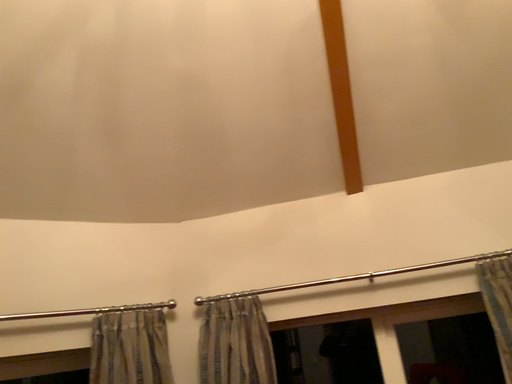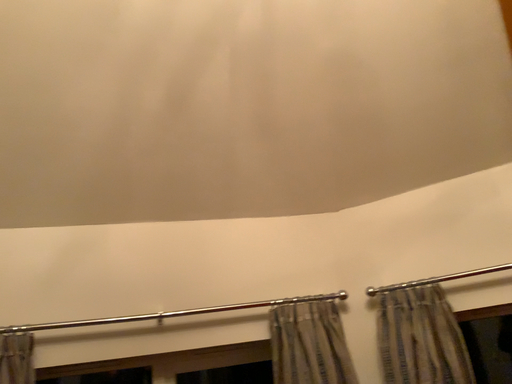
Question: How did the camera likely rotate when shooting the video?

Choices:
 (A) rotated right
 (B) rotated left

Answer: (B)